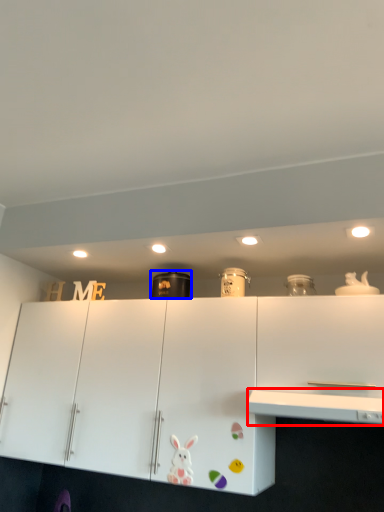
Question: Which object is closer to the camera taking this photo, counter top (highlighted by a red box) or appliance (highlighted by a blue box)?

Choices:
 (A) counter top
 (B) appliance

Answer: (A)